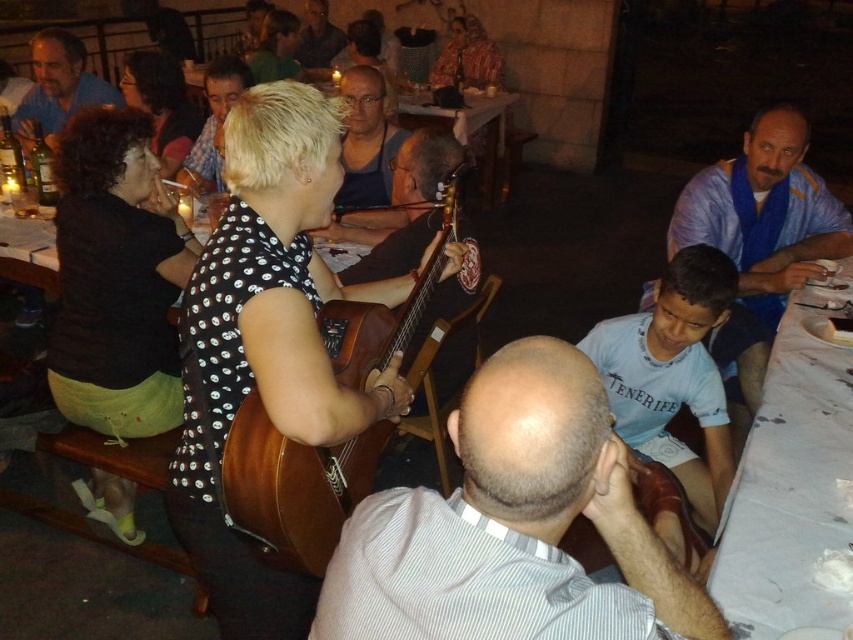
Who is lower down, light blue cotton shirt at lower right or matte blue shirt at upper left?

light blue cotton shirt at lower right is below.

Which is more to the left, light blue cotton shirt at lower right or matte blue shirt at upper left?

From the viewer's perspective, matte blue shirt at upper left appears more on the left side.

Who is more forward, (676, 316) or (84, 84)?

Point (676, 316) is more forward.

Locate an element on the screen. The width and height of the screenshot is (853, 640). light blue cotton shirt at lower right is located at coordinates (672, 374).

The height and width of the screenshot is (640, 853). What are the coordinates of `white paper table at lower right` in the screenshot? It's located at (788, 488).

Who is more forward, (805,433) or (741,326)?

Point (805,433) is more forward.

Locate an element on the screen. white paper table at lower right is located at coordinates (788, 488).

Is blue fabric shirt at right bigger than matte blue shirt at upper left?

No, blue fabric shirt at right is not bigger than matte blue shirt at upper left.

Can you confirm if blue fabric shirt at right is thinner than matte blue shirt at upper left?

No.

Describe the element at coordinates (759, 237) in the screenshot. I see `blue fabric shirt at right` at that location.

Where is `blue fabric shirt at right`? blue fabric shirt at right is located at coordinates (759, 237).